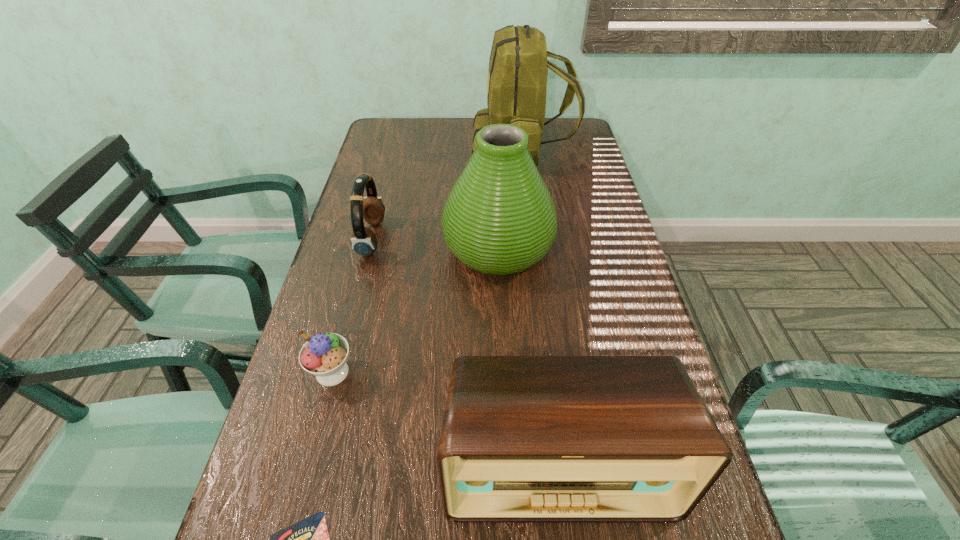
Locate an element on the screen. Image resolution: width=960 pixels, height=540 pixels. free space located 0.190m on the front of the second tallest object is located at coordinates (503, 351).

I want to click on blank space located 0.110m on the ear cup of the headset, so click(422, 239).

The image size is (960, 540). I want to click on free space located on the right of the fourth farthest object, so click(506, 372).

Where is `object located in the far edge section of the desktop`? This screenshot has height=540, width=960. object located in the far edge section of the desktop is located at coordinates (518, 67).

Identify the location of headset present at the left edge. The width and height of the screenshot is (960, 540). (364, 242).

Identify the location of icecream situated at the left edge. Image resolution: width=960 pixels, height=540 pixels. (324, 355).

Identify the location of backpack at the right edge. (518, 67).

Where is `radio receiver present at the right edge`? radio receiver present at the right edge is located at coordinates (525, 439).

At what (x,y) coordinates should I click in order to perform the action: click on object located at the far right corner. Please return your answer as a coordinate pair (x, y). Looking at the image, I should click on (518, 67).

Locate an element on the screen. free region at the left edge is located at coordinates (406, 180).